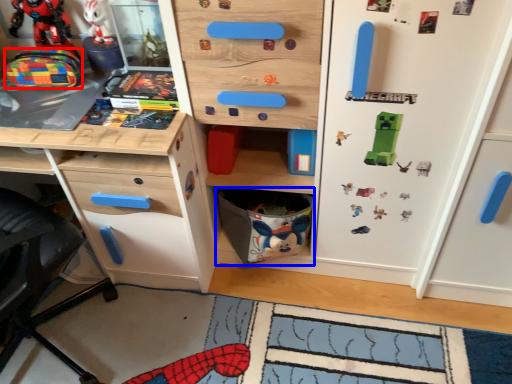
Question: Which object appears closest to the camera in this image, toy (highlighted by a red box) or cabinet (highlighted by a blue box)?

Choices:
 (A) toy
 (B) cabinet

Answer: (A)